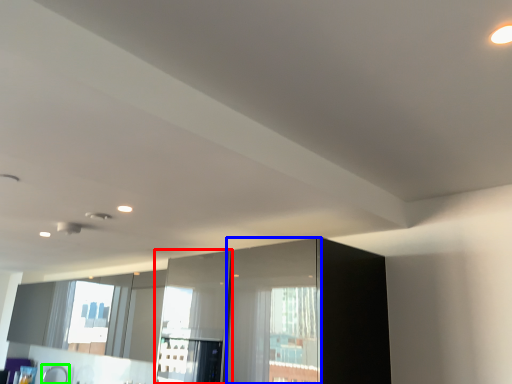
Question: Which is farther away from screen door (highlighted by a red box)? screen door (highlighted by a blue box) or faucet (highlighted by a green box)?

Choices:
 (A) screen door
 (B) faucet

Answer: (B)